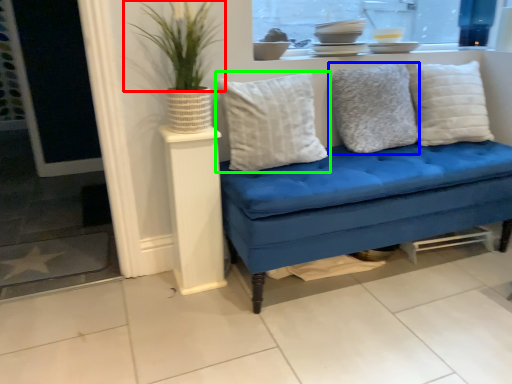
Question: Estimate the real-world distances between objects in this image. Which object is closer to plant (highlighted by a red box), pillow (highlighted by a blue box) or pillow (highlighted by a green box)?

Choices:
 (A) pillow
 (B) pillow

Answer: (B)